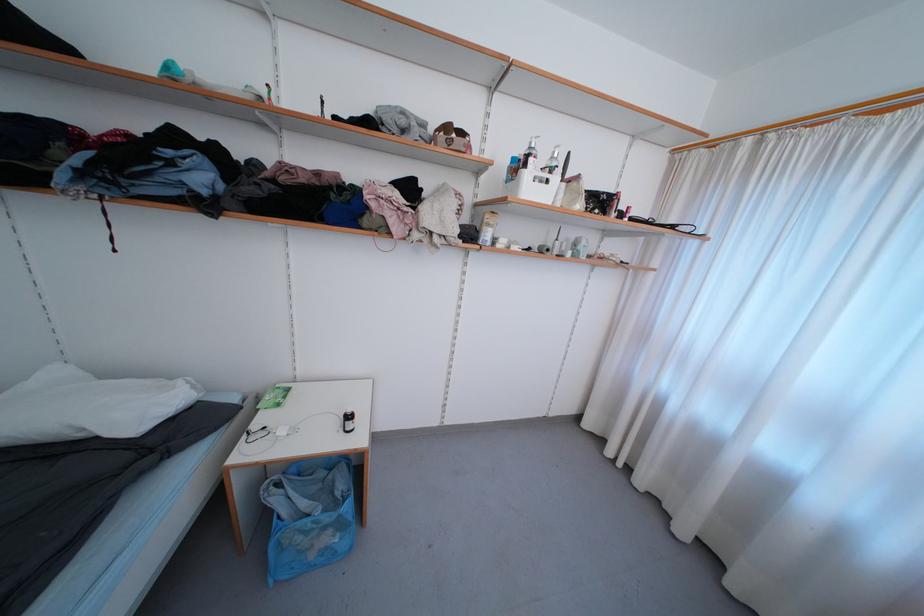
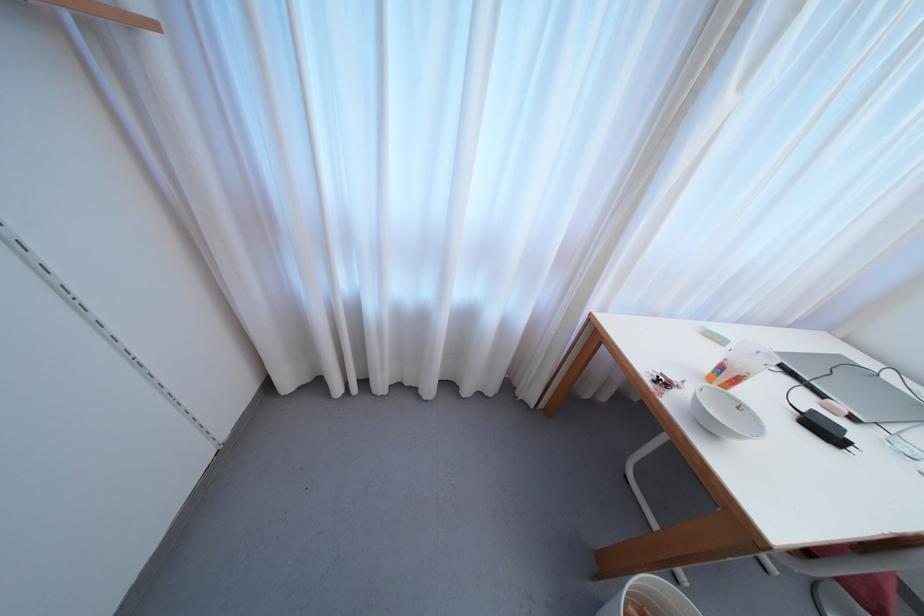
In the second image, find the point that corresponds to the point at 613,455 in the first image.

(342, 392)